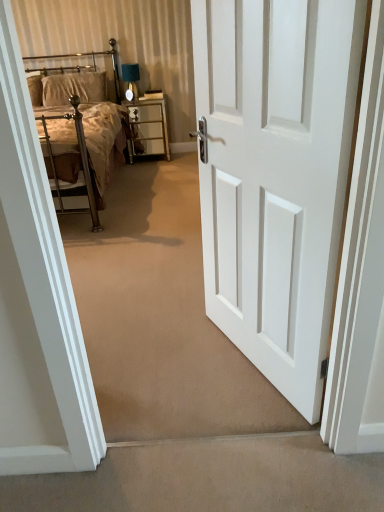
Measure the distance between point (76, 92) and camera.

A distance of 4.31 meters exists between point (76, 92) and camera.

From the picture: In order to face metallic gold nightstand at center, should I rotate leftwards or rightwards?

Turn left approximately 5.938 degrees to face it.

Find the location of a particular element. Image resolution: width=384 pixels, height=512 pixels. white painted wood door at center is located at coordinates (275, 175).

From a real-world perspective, is beige carpet at lower center over white painted wood door at center?

Incorrect, from a real-world perspective, beige carpet at lower center is lower than white painted wood door at center.

Can you confirm if beige carpet at lower center is shorter than white painted wood door at center?

Yes.

Can you confirm if beige carpet at lower center is wider than white painted wood door at center?

Yes, beige carpet at lower center is wider than white painted wood door at center.

From the image's perspective, is beige carpet at lower center located above white painted wood door at center?

No, from the image's perspective, beige carpet at lower center is not above white painted wood door at center.

Based on their sizes in the image, would you say metallic silver bed at upper left is bigger or smaller than beige carpet at lower center?

Considering their sizes, metallic silver bed at upper left takes up more space than beige carpet at lower center.

From the image's perspective, which one is positioned higher, metallic silver bed at upper left or beige carpet at lower center?

metallic silver bed at upper left.

Which of these two, metallic silver bed at upper left or beige carpet at lower center, stands shorter?

beige carpet at lower center is shorter.

How different are the orientations of metallic silver bed at upper left and beige carpet at lower center in degrees?

The angular difference between metallic silver bed at upper left and beige carpet at lower center is 180 degrees.

Are beige carpet at lower center and metallic silver bed at upper left making contact?

They are not placed beside each other.

Is beige carpet at lower center wider or thinner than metallic silver bed at upper left?

beige carpet at lower center is thinner than metallic silver bed at upper left.

Between point (202, 456) and point (86, 66), which one is positioned behind?

The point (86, 66) is farther from the camera.

Considering the sizes of beige carpet at lower center and metallic silver bed at upper left in the image, is beige carpet at lower center taller or shorter than metallic silver bed at upper left?

In the image, beige carpet at lower center appears to be shorter than metallic silver bed at upper left.

Does metallic silver bed at upper left appear on the left side of metallic silver headboard at upper left?

Yes, metallic silver bed at upper left is to the left of metallic silver headboard at upper left.

Which object is wider, metallic silver bed at upper left or metallic silver headboard at upper left?

With larger width is metallic silver bed at upper left.

Is metallic silver bed at upper left positioned before metallic silver headboard at upper left?

That is True.

From a real-world perspective, is velvet beige pillow at upper left positioned over metallic silver headboard at upper left based on gravity?

No, from a real-world perspective, velvet beige pillow at upper left is not above metallic silver headboard at upper left.

Which of these two, velvet beige pillow at upper left or metallic silver headboard at upper left, is bigger?

metallic silver headboard at upper left.

Where is `headboard in front of the velvet beige pillow at upper left`? This screenshot has width=384, height=512. headboard in front of the velvet beige pillow at upper left is located at coordinates (93, 62).

Considering the relative sizes of velvet beige pillow at upper left and metallic silver headboard at upper left in the image provided, is velvet beige pillow at upper left thinner than metallic silver headboard at upper left?

Yes.

From a real-world perspective, is beige carpet at lower center physically located above or below metallic silver headboard at upper left?

In terms of real-world spatial position, beige carpet at lower center is below metallic silver headboard at upper left.

Is the depth of beige carpet at lower center greater than that of metallic silver headboard at upper left?

No, it is not.

Considering the positions of point (58, 499) and point (115, 85), is point (58, 499) closer or farther from the camera than point (115, 85)?

Point (58, 499) is positioned closer to the camera compared to point (115, 85).

In the scene shown: Between beige carpet at lower center and metallic silver headboard at upper left, which one has less height?

beige carpet at lower center.

The height and width of the screenshot is (512, 384). I want to click on nightstand behind the metallic silver headboard at upper left, so click(148, 128).

Which object is further away from the camera taking this photo, metallic silver headboard at upper left or metallic gold nightstand at center?

metallic gold nightstand at center.

Which object is thinner, metallic silver headboard at upper left or metallic gold nightstand at center?

Thinner between the two is metallic silver headboard at upper left.

From a real-world perspective, relative to metallic gold nightstand at center, is metallic silver headboard at upper left vertically above or below?

metallic silver headboard at upper left is above metallic gold nightstand at center.

Identify the location of stairwell below the white painted wood door at center (from a real-world perspective). (210, 478).

Locate an element on the screen. The height and width of the screenshot is (512, 384). bed that is behind the beige carpet at lower center is located at coordinates 80,129.

Based on their spatial positions, is velvet beige pillow at upper left or beige carpet at lower center further from metallic silver headboard at upper left?

beige carpet at lower center is positioned further to the anchor metallic silver headboard at upper left.

When comparing their distances from velvet beige pillow at upper left, does beige carpet at lower center or white painted wood door at center seem further?

The object further to velvet beige pillow at upper left is beige carpet at lower center.

Estimate the real-world distances between objects in this image. Which object is further from metallic silver bed at upper left, white painted wood door at center or beige carpet at lower center?

Based on the image, beige carpet at lower center appears to be further to metallic silver bed at upper left.

From the image, which object appears to be nearer to metallic silver bed at upper left, velvet beige pillow at upper left or beige carpet at lower center?

Among the two, velvet beige pillow at upper left is located nearer to metallic silver bed at upper left.

Based on their spatial positions, is metallic silver bed at upper left or metallic gold nightstand at center further from white painted wood door at center?

The object further to white painted wood door at center is metallic gold nightstand at center.

Estimate the real-world distances between objects in this image. Which object is further from white painted wood door at center, metallic silver headboard at upper left or metallic gold nightstand at center?

Among the two, metallic silver headboard at upper left is located further to white painted wood door at center.

Estimate the real-world distances between objects in this image. Which object is further from white painted wood door at center, metallic silver bed at upper left or metallic silver headboard at upper left?

Among the two, metallic silver headboard at upper left is located further to white painted wood door at center.

Estimate the real-world distances between objects in this image. Which object is further from beige carpet at lower center, white painted wood door at center or metallic silver bed at upper left?

Among the two, metallic silver bed at upper left is located further to beige carpet at lower center.

Locate an element on the screen. The width and height of the screenshot is (384, 512). headboard between white painted wood door at center and metallic gold nightstand at center along the z-axis is located at coordinates (93, 62).

The height and width of the screenshot is (512, 384). I want to click on stairwell positioned between white painted wood door at center and velvet beige pillow at upper left from near to far, so click(210, 478).

Find the location of a particular element. The height and width of the screenshot is (512, 384). pillow positioned between metallic silver bed at upper left and metallic gold nightstand at center from near to far is located at coordinates (74, 88).

The height and width of the screenshot is (512, 384). Find the location of `stairwell between white painted wood door at center and metallic gold nightstand at center from front to back`. stairwell between white painted wood door at center and metallic gold nightstand at center from front to back is located at coordinates (210, 478).